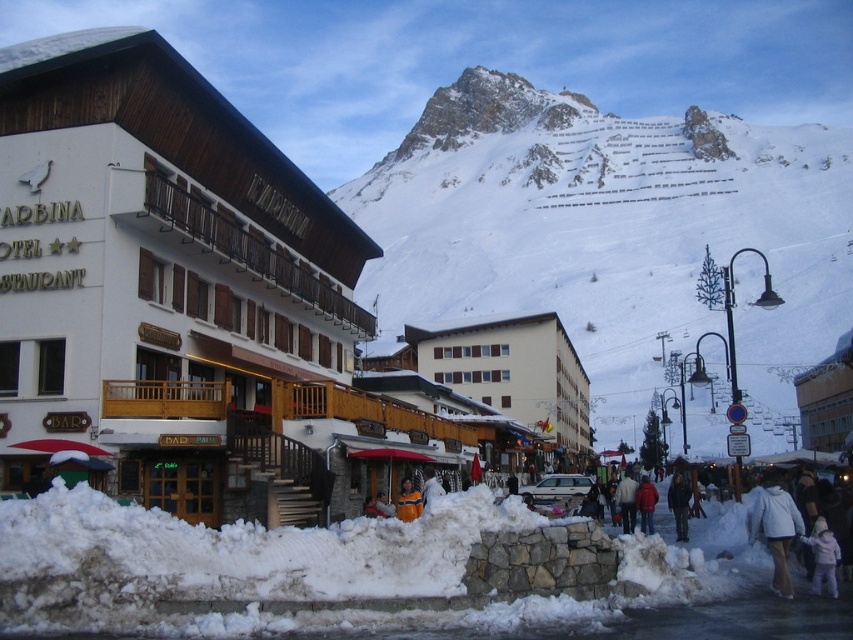
You are a delivery person standing at the entrance of Le Carillon restaurant, and you need to deliver a package to the person wearing the dark blue jacket at lower right and the red woolen jacket at lower right. The delivery cart you are using can only move in a straight line and has a maximum reach of 15 feet. Can you reach both recipients with a single straight path without moving the cart?

The distance between the dark blue jacket at lower right and the red woolen jacket at lower right is 16.56 feet, which exceeds the cart maximum reach of 15 feet. Therefore, you cannot reach both recipients with a single straight path without moving the cart.

You are a photographer standing on the snow covered street in front of Le Carillon Restaurant. You notice two coats at the lower right of your viewfinder. The white fleece jacket at lower right and the light pink fabric coat at lower right. Which one appears lower in your view?

The white fleece jacket at lower right appears lower in the view because it is located below the light pink fabric coat at lower right.